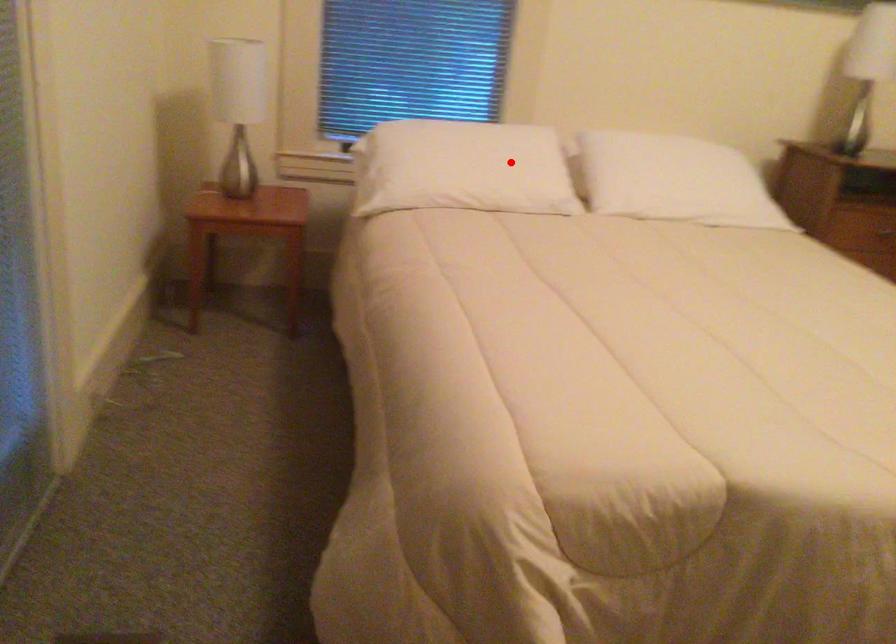
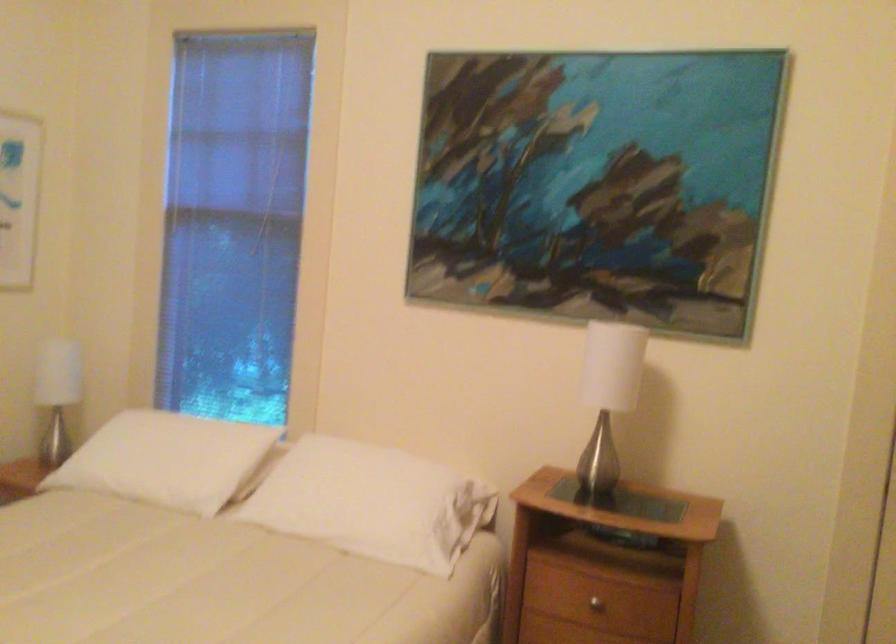
Where in the second image is the point corresponding to the highlighted location from the first image?

(167, 459)